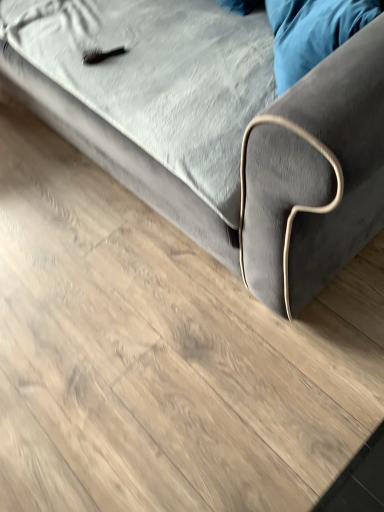
Question: In the image, is velvet blue pillow at upper right on the left side or the right side of velvet gray couch at upper center?

Choices:
 (A) right
 (B) left

Answer: (A)

Question: From the image's perspective, is velvet blue pillow at upper right located above or below velvet gray couch at upper center?

Choices:
 (A) below
 (B) above

Answer: (A)

Question: Is point (274, 27) positioned closer to the camera than point (291, 137)?

Choices:
 (A) closer
 (B) farther

Answer: (B)

Question: Considering the positions of point (59, 54) and point (339, 8), is point (59, 54) closer or farther from the camera than point (339, 8)?

Choices:
 (A) farther
 (B) closer

Answer: (A)

Question: Looking at their shapes, would you say velvet gray couch at upper center is wider or thinner than velvet blue pillow at upper right?

Choices:
 (A) wide
 (B) thin

Answer: (A)

Question: From their relative heights in the image, would you say velvet gray couch at upper center is taller or shorter than velvet blue pillow at upper right?

Choices:
 (A) short
 (B) tall

Answer: (B)

Question: In the image, is velvet gray couch at upper center on the left side or the right side of velvet blue pillow at upper right?

Choices:
 (A) right
 (B) left

Answer: (B)